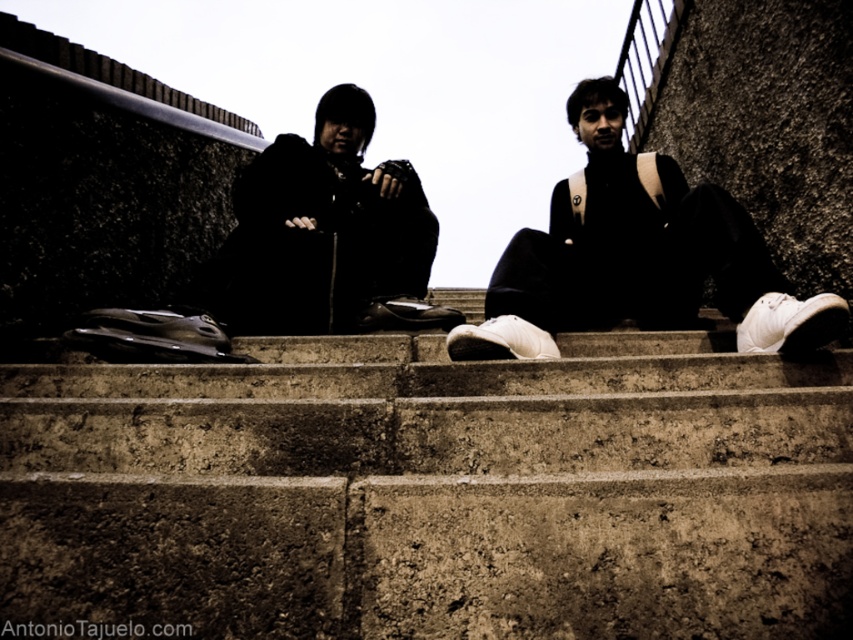
Question: Is concrete stairs at center further to camera compared to black matte jacket at center?

Choices:
 (A) yes
 (B) no

Answer: (B)

Question: Does concrete stairs at center have a larger size compared to black matte jacket at center?

Choices:
 (A) no
 (B) yes

Answer: (A)

Question: Which point is closer to the camera taking this photo?

Choices:
 (A) (281, 291)
 (B) (525, 250)

Answer: (B)

Question: Which point is farther to the camera?

Choices:
 (A) white matte sneakers at center
 (B) black matte jacket at center
 (C) concrete stairs at center

Answer: (B)

Question: Can you confirm if concrete stairs at center is smaller than black matte jacket at center?

Choices:
 (A) yes
 (B) no

Answer: (A)

Question: Which object appears closest to the camera in this image?

Choices:
 (A) black matte jacket at center
 (B) concrete stairs at center

Answer: (B)